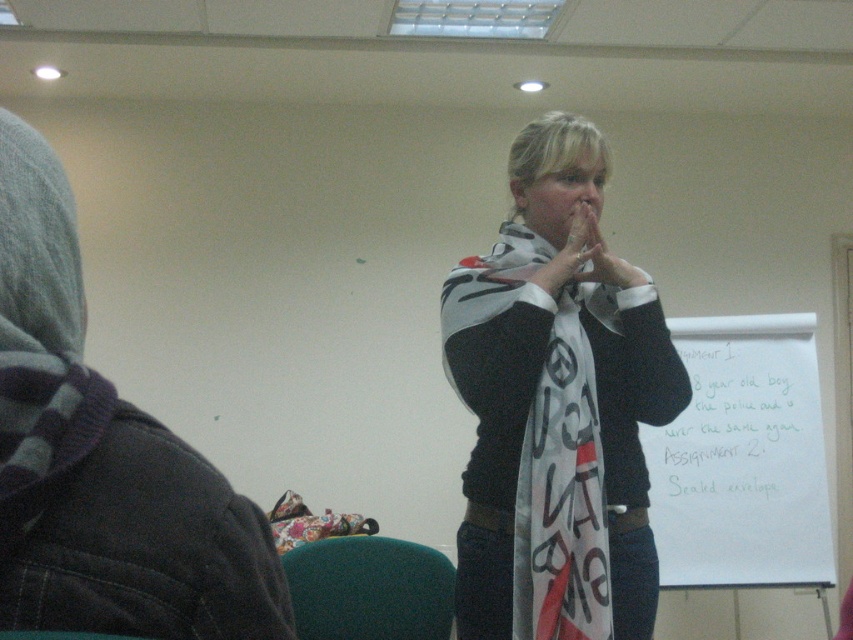
Question: Can you confirm if gray fleece hoodie at left is thinner than white fabric hand at center?

Choices:
 (A) yes
 (B) no

Answer: (B)

Question: Which point is closer to the camera?

Choices:
 (A) (595, 220)
 (B) (45, 244)
 (C) (584, 252)

Answer: (B)

Question: Which point is farther to the camera?

Choices:
 (A) (596, 182)
 (B) (590, 595)
 (C) (239, 548)

Answer: (A)

Question: Can you confirm if white printed scarf at center is wider than white fabric hand at center?

Choices:
 (A) yes
 (B) no

Answer: (A)

Question: Does gray fleece hoodie at left appear on the left side of white fabric hand at center?

Choices:
 (A) no
 (B) yes

Answer: (B)

Question: Estimate the real-world distances between objects in this image. Which object is closer to the white paper at center?

Choices:
 (A) white printed scarf at center
 (B) matte black nose at center
 (C) white fabric hand at center

Answer: (A)